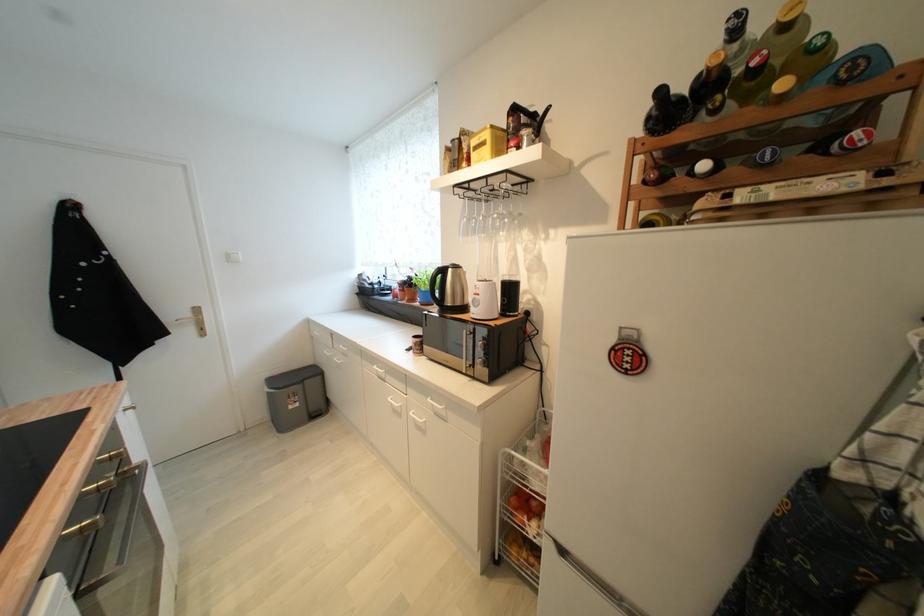
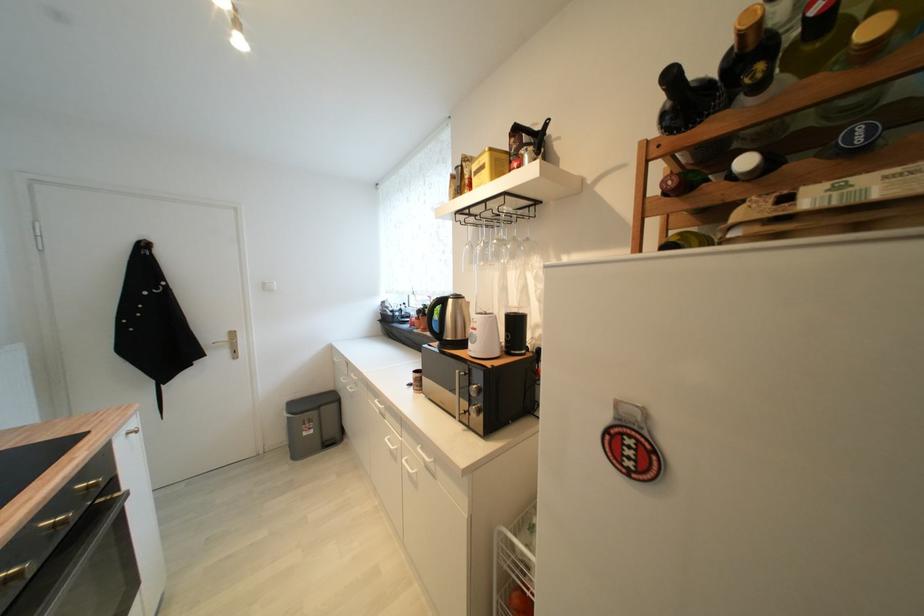
In the second image, find the point that corresponds to [709,168] in the first image.

(751, 164)